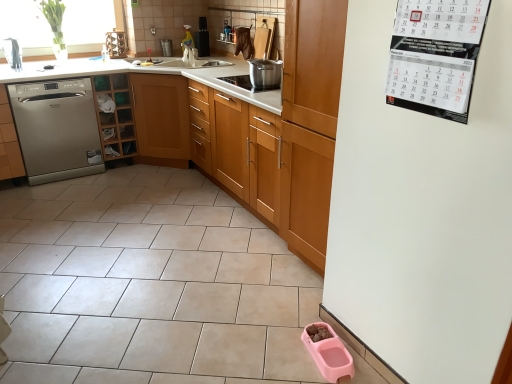
The width and height of the screenshot is (512, 384). Find the location of `vacant space to the right of pink plastic pet food bowl at lower right`. vacant space to the right of pink plastic pet food bowl at lower right is located at coordinates (354, 356).